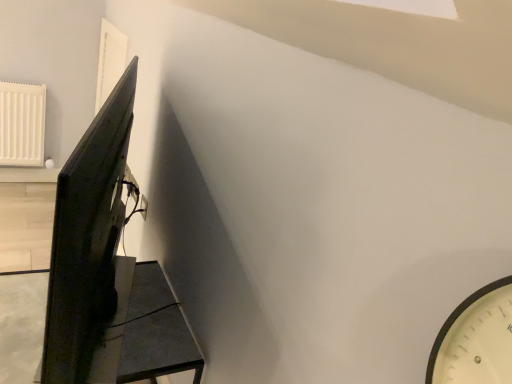
The width and height of the screenshot is (512, 384). Find the location of `matte black table at lower left`. matte black table at lower left is located at coordinates (144, 330).

At what (x,y) coordinates should I click in order to perform the action: click on matte black table at lower left. Please return your answer as a coordinate pair (x, y). Looking at the image, I should click on (144, 330).

Relative to matte black table at lower left, is matte black monitor at left in front or behind?

In the image, matte black monitor at left appears in front of matte black table at lower left.

Which object is positioned more to the right, matte black monitor at left or matte black table at lower left?

matte black monitor at left is more to the right.

Looking at this image, which is correct: matte black monitor at left is inside matte black table at lower left, or outside of it?

The correct answer is: outside.

Based on the photo, is matte black monitor at left aimed at matte black table at lower left?

No.

In the scene shown: Is matte black table at lower left directly adjacent to white plastic electric outlet at upper center?

No, matte black table at lower left is not with white plastic electric outlet at upper center.

From the image's perspective, does matte black table at lower left appear lower than white plastic electric outlet at upper center?

Yes, from the image's perspective, matte black table at lower left is below white plastic electric outlet at upper center.

The height and width of the screenshot is (384, 512). Find the location of `furniture that is on the left side of white plastic electric outlet at upper center`. furniture that is on the left side of white plastic electric outlet at upper center is located at coordinates (144, 330).

Who is smaller, matte black table at lower left or white plastic electric outlet at upper center?

white plastic electric outlet at upper center.

Is point (181, 347) less distant than point (99, 246)?

Yes.

Where is `furniture located below the matte black monitor at left (from the image's perspective)`? The image size is (512, 384). furniture located below the matte black monitor at left (from the image's perspective) is located at coordinates (144, 330).

Looking at the image, does matte black table at lower left seem bigger or smaller compared to matte black monitor at left?

Considering their sizes, matte black table at lower left takes up more space than matte black monitor at left.

From a real-world perspective, is matte black table at lower left positioned over matte black monitor at left based on gravity?

Incorrect, from a real-world perspective, matte black table at lower left is lower than matte black monitor at left.

From the picture: Is white plastic electric outlet at upper center not within matte black monitor at left?

Absolutely, white plastic electric outlet at upper center is external to matte black monitor at left.

Which object is positioned more to the right, white plastic electric outlet at upper center or matte black monitor at left?

Positioned to the right is matte black monitor at left.

How different are the orientations of white plastic electric outlet at upper center and matte black monitor at left in degrees?

The angle between the facing direction of white plastic electric outlet at upper center and the facing direction of matte black monitor at left is 16.9 degrees.

From a real-world perspective, is white plastic electric outlet at upper center under matte black monitor at left?

Yes, from a real-world perspective, white plastic electric outlet at upper center is below matte black monitor at left.

Is matte black monitor at left surrounding white plastic electric outlet at upper center?

No, white plastic electric outlet at upper center is located outside of matte black monitor at left.

From a real-world perspective, which object stands above the other?

From a 3D spatial view, matte black monitor at left is above.

Is matte black monitor at left looking in the opposite direction of white plastic electric outlet at upper center?

Absolutely, matte black monitor at left is directed away from white plastic electric outlet at upper center.

From the image's perspective, is matte black monitor at left located beneath white plastic electric outlet at upper center?

No, from the image's perspective, matte black monitor at left is not beneath white plastic electric outlet at upper center.

Is white plastic electric outlet at upper center positioned beyond the bounds of matte black table at lower left?

Answer: Indeed, white plastic electric outlet at upper center is completely outside matte black table at lower left.

Can you confirm if white plastic electric outlet at upper center is bigger than matte black table at lower left?

No.

In the scene shown: Who is shorter, white plastic electric outlet at upper center or matte black table at lower left?

With less height is white plastic electric outlet at upper center.

From the image's perspective, relative to matte black table at lower left, is white plastic electric outlet at upper center above or below?

From the image's perspective, white plastic electric outlet at upper center appears above matte black table at lower left.

At what (x,y) coordinates should I click in order to perform the action: click on computer monitor above the matte black table at lower left (from the image's perspective). Please return your answer as a coordinate pair (x, y). Looking at the image, I should click on (88, 239).

You are a GUI agent. You are given a task and a screenshot of the screen. Output one action in this format:
    pyautogui.click(x=<x>, y=<y>)
    Task: Click on the electric outlet behind the matte black table at lower left
    This screenshot has height=384, width=512.
    Given the screenshot: What is the action you would take?
    pyautogui.click(x=143, y=206)

Estimate the real-world distances between objects in this image. Which object is closer to white plastic electric outlet at upper center, matte black table at lower left or matte black monitor at left?

matte black table at lower left is closer to white plastic electric outlet at upper center.

When comparing their distances from white plastic electric outlet at upper center, does matte black monitor at left or matte black table at lower left seem further?

matte black monitor at left is positioned further to the anchor white plastic electric outlet at upper center.

Looking at the image, which one is located further to matte black table at lower left, matte black monitor at left or white plastic electric outlet at upper center?

white plastic electric outlet at upper center is further to matte black table at lower left.

Which object lies further to the anchor point matte black table at lower left, white plastic electric outlet at upper center or matte black monitor at left?

The object further to matte black table at lower left is white plastic electric outlet at upper center.

Which object lies nearer to the anchor point matte black monitor at left, white plastic electric outlet at upper center or matte black table at lower left?

matte black table at lower left lies closer to matte black monitor at left than the other object.

Based on their spatial positions, is matte black table at lower left or white plastic electric outlet at upper center closer to matte black monitor at left?

matte black table at lower left is closer to matte black monitor at left.

You are a GUI agent. You are given a task and a screenshot of the screen. Output one action in this format:
    pyautogui.click(x=<x>, y=<y>)
    Task: Click on the furniture between matte black monitor at left and white plastic electric outlet at upper center along the z-axis
    This screenshot has height=384, width=512.
    Given the screenshot: What is the action you would take?
    (144, 330)